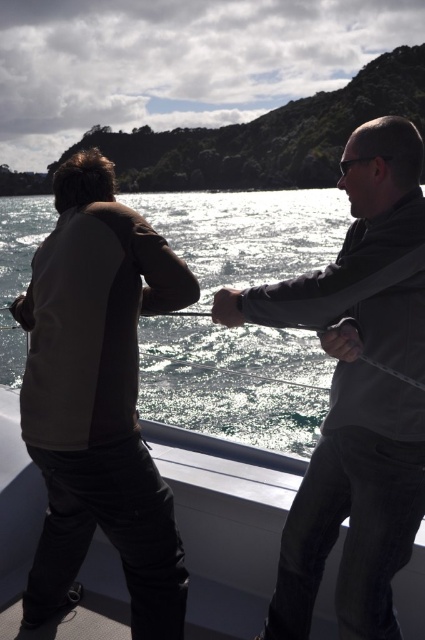
Does point (102, 518) come in front of point (408, 618)?

That is True.

Consider the image. Who is more distant from viewer, [34,568] or [184,522]?

The point [184,522] is more distant.

The image size is (425, 640). Find the location of `brown leather jacket at left`. brown leather jacket at left is located at coordinates (98, 400).

Is point (362, 132) farther from camera compared to point (187, 493)?

No, it is in front of (187, 493).

In the scene shown: Between dark gray fabric jacket at right and white glossy boat at lower center, which one has more height?

dark gray fabric jacket at right

Is point (357, 621) closer to viewer compared to point (20, 531)?

That is True.

Locate an element on the screen. The image size is (425, 640). dark gray fabric jacket at right is located at coordinates (357, 392).

Measure the distance from brown leather jacket at left to metallic rod at center.

A distance of 13.34 feet exists between brown leather jacket at left and metallic rod at center.

What do you see at coordinates (98, 400) in the screenshot?
I see `brown leather jacket at left` at bounding box center [98, 400].

Image resolution: width=425 pixels, height=640 pixels. I want to click on brown leather jacket at left, so click(x=98, y=400).